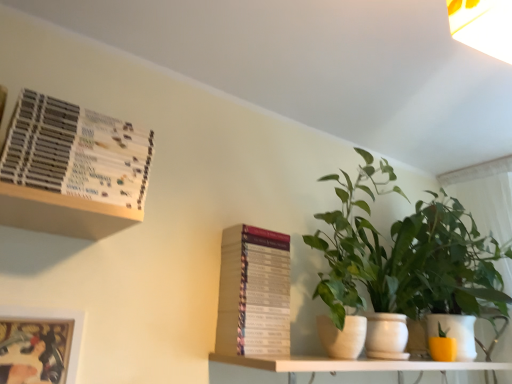
Question: Would you say green leafy plant at right, which ranks as the 1th houseplant in left-to-right order, is outside hardcover book at center, arranged as the 2th paperback book when viewed from the top?

Choices:
 (A) no
 (B) yes

Answer: (B)

Question: From the image's perspective, is green leafy plant at right, which is counted as the 2th houseplant, starting from the right, below hardcover book at center, the first paperback book when ordered from right to left?

Choices:
 (A) yes
 (B) no

Answer: (B)

Question: Is hardcover book at center, which is the 1th paperback book in back-to-front order, at the back of green leafy plant at right, which ranks as the 1th houseplant in left-to-right order?

Choices:
 (A) no
 (B) yes

Answer: (A)

Question: Considering the relative sizes of green leafy plant at right, which is counted as the 2th houseplant, starting from the right, and hardcover book at center, the first paperback book when ordered from right to left, in the image provided, is green leafy plant at right, which is counted as the 2th houseplant, starting from the right, shorter than hardcover book at center, the first paperback book when ordered from right to left,?

Choices:
 (A) yes
 (B) no

Answer: (B)

Question: Is green leafy plant at right, which ranks as the 1th houseplant in left-to-right order, to the right of hardcover book at center, the second paperback book positioned from the left, from the viewer's perspective?

Choices:
 (A) yes
 (B) no

Answer: (A)

Question: Is point (18, 345) closer or farther from the camera than point (458, 233)?

Choices:
 (A) farther
 (B) closer

Answer: (B)

Question: From the image's perspective, is metallic silver picture frame at lower left positioned above or below green leafy plant at right, which appears as the second houseplant when viewed from the left?

Choices:
 (A) below
 (B) above

Answer: (A)

Question: In the image, is metallic silver picture frame at lower left positioned in front of or behind green leafy plant at right, which appears as the second houseplant when viewed from the left?

Choices:
 (A) behind
 (B) front

Answer: (B)

Question: Is metallic silver picture frame at lower left spatially inside green leafy plant at right, which appears as the second houseplant when viewed from the left, or outside of it?

Choices:
 (A) inside
 (B) outside

Answer: (B)

Question: Choose the correct answer: Is hardcover book at center, the second paperback book positioned from the left, inside white matte shelf at lower center or outside it?

Choices:
 (A) inside
 (B) outside

Answer: (B)

Question: Is hardcover book at center, placed as the 2th paperback book when sorted from front to back, to the left or to the right of white matte shelf at lower center in the image?

Choices:
 (A) right
 (B) left

Answer: (B)

Question: Is point (279, 248) closer or farther from the camera than point (435, 367)?

Choices:
 (A) farther
 (B) closer

Answer: (A)

Question: In terms of width, does hardcover book at center, the second paperback book positioned from the left, look wider or thinner when compared to white matte shelf at lower center?

Choices:
 (A) thin
 (B) wide

Answer: (A)

Question: Is green leafy plant at right, which appears as the second houseplant when viewed from the left, bigger or smaller than hardcover book at center, arranged as the 2th paperback book when viewed from the top?

Choices:
 (A) small
 (B) big

Answer: (B)

Question: From the image's perspective, relative to hardcover book at center, the first paperback book in the bottom-to-top sequence, is green leafy plant at right, which appears as the second houseplant when viewed from the left, above or below?

Choices:
 (A) above
 (B) below

Answer: (A)